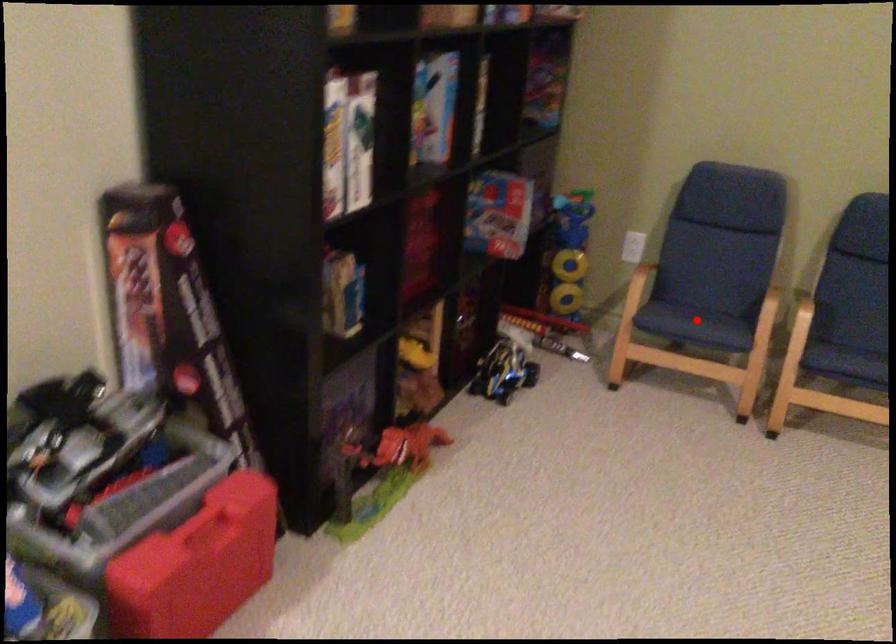
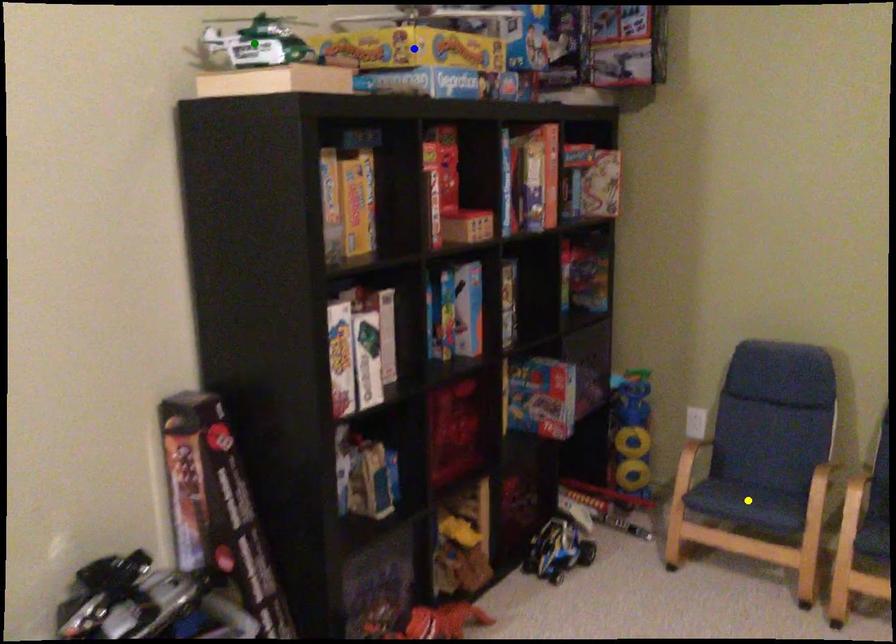
Question: I am providing you with two images of the same scene from different viewpoints. A red point is marked on the first image. You are given multiple points on the second image. Can you choose the point in image 2 that corresponds to the point in image 1?

Choices:
 (A) green point
 (B) blue point
 (C) yellow point

Answer: (C)